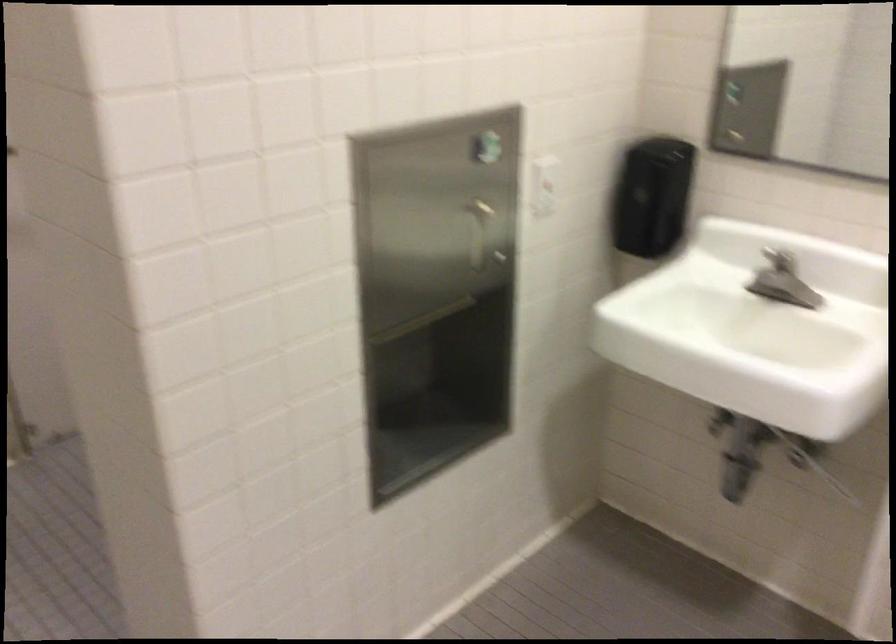
Find where to pull the metal T-handle. Please return your answer as a coordinate pair (x, y).

(778, 259)